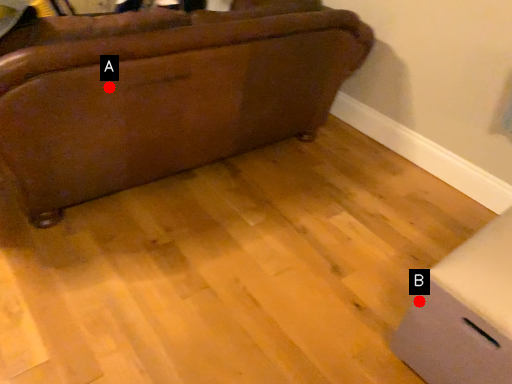
Question: Two points are circled on the image, labeled by A and B beside each circle. Which of the following is the farthest from the observer?

Choices:
 (A) A is further
 (B) B is further

Answer: (A)